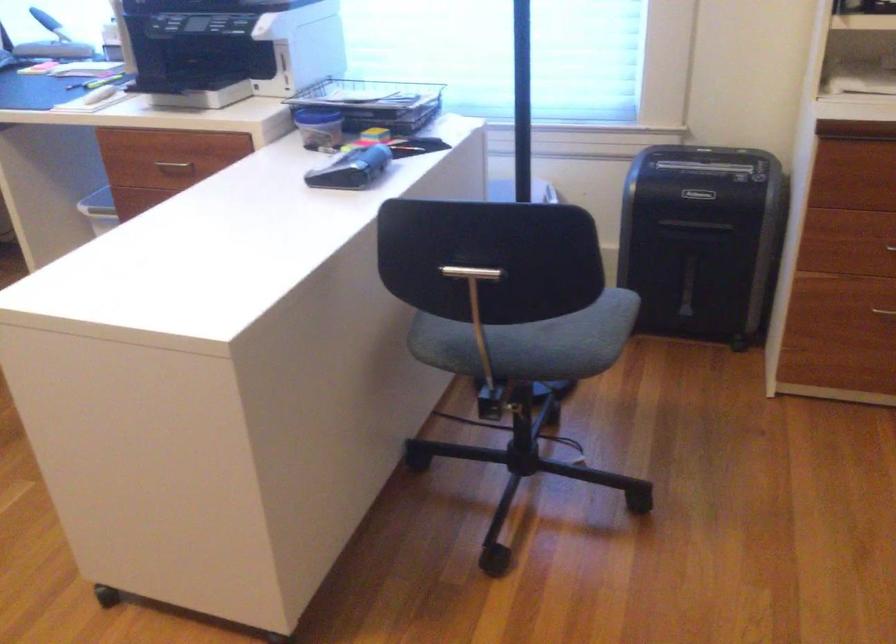
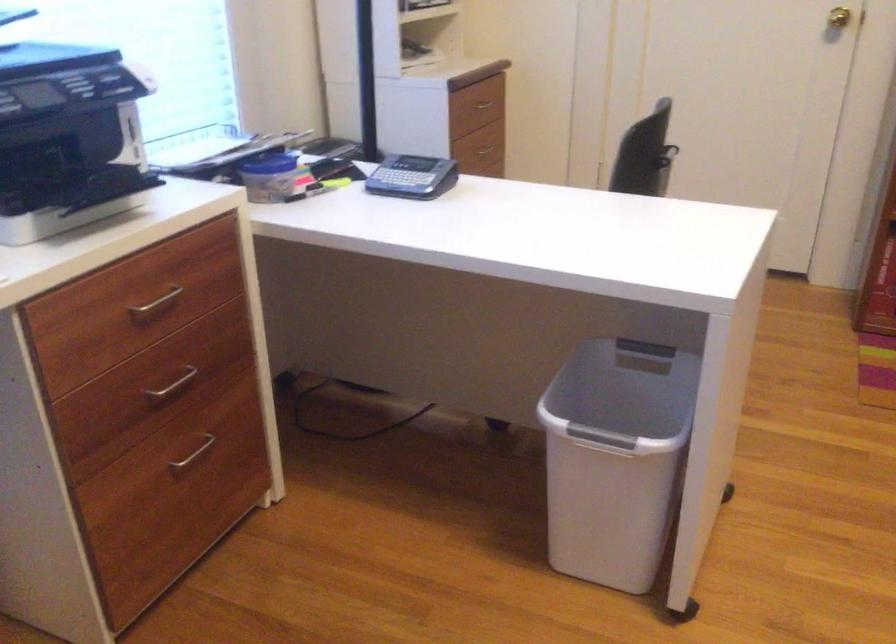
Question: I am providing you with two images of the same scene from different viewpoints. Which of the following objects are not visible in image2?

Choices:
 (A) drawer handle
 (B) trash can lid handle
 (C) metal drawer handle
 (D) clear wall hook

Answer: (C)